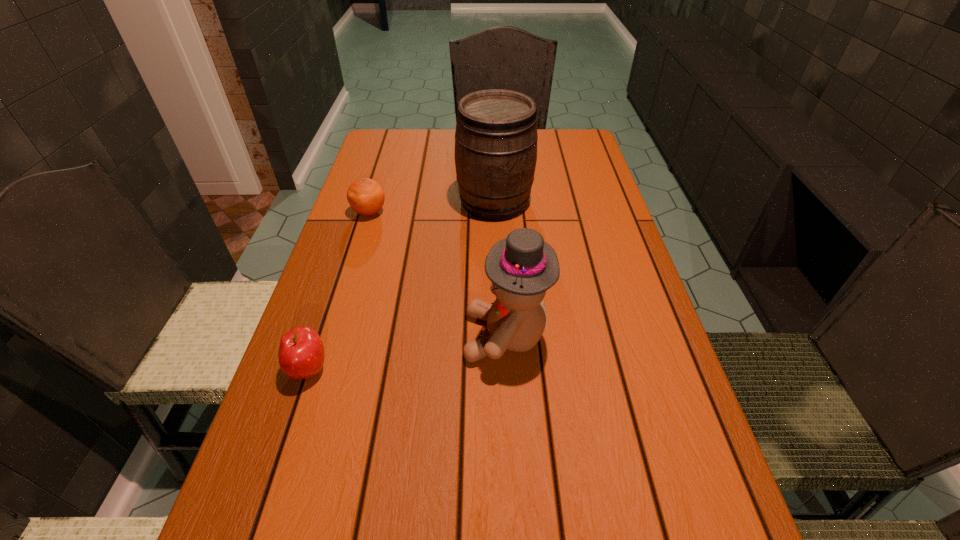
Where is `wine bucket`? The height and width of the screenshot is (540, 960). wine bucket is located at coordinates (496, 136).

Identify the location of rag_doll. (521, 267).

Where is `orange`? The width and height of the screenshot is (960, 540). orange is located at coordinates (366, 197).

At what (x,y) coordinates should I click in order to perform the action: click on apple. Please return your answer as a coordinate pair (x, y). Looking at the image, I should click on (301, 354).

I want to click on vacant area situated 0.130m on the back of the wine bucket, so click(492, 159).

Find the location of a particular element. vacant space located on the front-facing side of the rag_doll is located at coordinates (400, 336).

The width and height of the screenshot is (960, 540). In order to click on vacant region located on the front-facing side of the rag_doll in this screenshot , I will do `click(415, 336)`.

This screenshot has height=540, width=960. I want to click on vacant space situated on the front-facing side of the rag_doll, so click(x=400, y=336).

This screenshot has width=960, height=540. What are the coordinates of `free spot located 0.390m on the right of the orange` in the screenshot? It's located at (530, 212).

This screenshot has height=540, width=960. What are the coordinates of `vacant space situated on the front of the apple` in the screenshot? It's located at (261, 514).